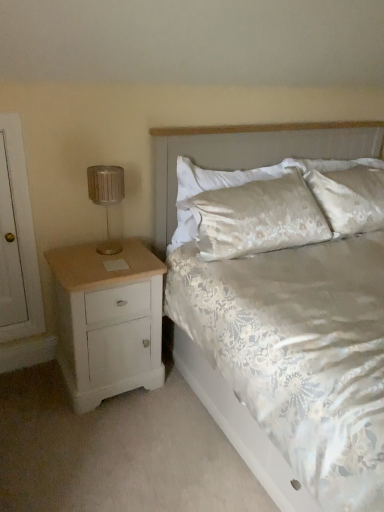
Where is `free region under metallic silver lamp at left (from a real-world perspective)`? free region under metallic silver lamp at left (from a real-world perspective) is located at coordinates (111, 247).